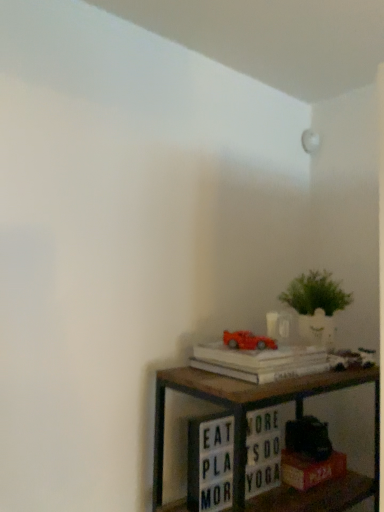
Question: Is wooden shelf at lower right positioned with its back to hardcover book at lower right, placed as the 1th paperback book when sorted from bottom to top?

Choices:
 (A) no
 (B) yes

Answer: (B)

Question: Considering the relative positions of wooden shelf at lower right and hardcover book at lower right, placed as the 1th paperback book when sorted from bottom to top, in the image provided, is wooden shelf at lower right in front of hardcover book at lower right, placed as the 1th paperback book when sorted from bottom to top,?

Choices:
 (A) no
 (B) yes

Answer: (B)

Question: Could you tell me if wooden shelf at lower right is facing hardcover book at lower right, placed as the 1th paperback book when sorted from bottom to top?

Choices:
 (A) no
 (B) yes

Answer: (B)

Question: Considering the relative sizes of wooden shelf at lower right and hardcover book at lower right, the second paperback book positioned from the top, in the image provided, is wooden shelf at lower right bigger than hardcover book at lower right, the second paperback book positioned from the top,?

Choices:
 (A) yes
 (B) no

Answer: (A)

Question: Does wooden shelf at lower right have a greater height compared to hardcover book at lower right, the second paperback book positioned from the top?

Choices:
 (A) no
 (B) yes

Answer: (B)

Question: Is white paper at upper right, arranged as the first paperback book when viewed from the top, spatially inside wooden shelf at lower right, or outside of it?

Choices:
 (A) outside
 (B) inside

Answer: (A)

Question: In the image, is white paper at upper right, arranged as the first paperback book when viewed from the top, on the left side or the right side of wooden shelf at lower right?

Choices:
 (A) left
 (B) right

Answer: (A)

Question: Is point (268, 353) positioned closer to the camera than point (200, 398)?

Choices:
 (A) closer
 (B) farther

Answer: (B)

Question: From a real-world perspective, is white paper at upper right, positioned as the 2th paperback book in bottom-to-top order, positioned above or below wooden shelf at lower right?

Choices:
 (A) above
 (B) below

Answer: (A)

Question: From a real-world perspective, is white paper at upper right, arranged as the first paperback book when viewed from the top, positioned above or below hardcover book at lower right, the second paperback book positioned from the top?

Choices:
 (A) below
 (B) above

Answer: (B)

Question: Choose the correct answer: Is white paper at upper right, arranged as the first paperback book when viewed from the top, inside hardcover book at lower right, placed as the 1th paperback book when sorted from bottom to top, or outside it?

Choices:
 (A) outside
 (B) inside

Answer: (A)

Question: Is white paper at upper right, arranged as the first paperback book when viewed from the top, bigger or smaller than hardcover book at lower right, the second paperback book positioned from the top?

Choices:
 (A) big
 (B) small

Answer: (A)

Question: In terms of width, does white paper at upper right, arranged as the first paperback book when viewed from the top, look wider or thinner when compared to hardcover book at lower right, the second paperback book positioned from the top?

Choices:
 (A) wide
 (B) thin

Answer: (A)

Question: Visually, is wooden shelf at lower right positioned to the left or to the right of shiny plastic car at upper right?

Choices:
 (A) left
 (B) right

Answer: (B)

Question: In the image, is wooden shelf at lower right positioned in front of or behind shiny plastic car at upper right?

Choices:
 (A) behind
 (B) front

Answer: (B)